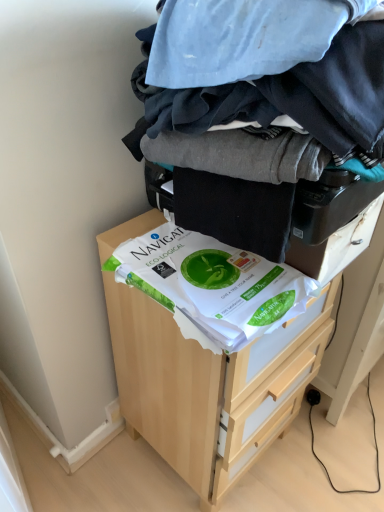
Question: From a real-world perspective, is white paper at center positioned over light wood chest of drawers at center based on gravity?

Choices:
 (A) no
 (B) yes

Answer: (B)

Question: Considering the relative sizes of white paper at center and light wood chest of drawers at center in the image provided, is white paper at center smaller than light wood chest of drawers at center?

Choices:
 (A) no
 (B) yes

Answer: (B)

Question: Is white paper at center directly adjacent to light wood chest of drawers at center?

Choices:
 (A) yes
 (B) no

Answer: (B)

Question: Does white paper at center have a greater height compared to light wood chest of drawers at center?

Choices:
 (A) no
 (B) yes

Answer: (A)

Question: Is white paper at center aimed at light wood chest of drawers at center?

Choices:
 (A) no
 (B) yes

Answer: (A)

Question: Can you confirm if white paper at center is bigger than light wood chest of drawers at center?

Choices:
 (A) no
 (B) yes

Answer: (A)

Question: Is dark blue cotton laundry at center oriented away from light wood chest of drawers at center?

Choices:
 (A) no
 (B) yes

Answer: (A)

Question: Could you tell me if dark blue cotton laundry at center is facing light wood chest of drawers at center?

Choices:
 (A) yes
 (B) no

Answer: (B)

Question: Is dark blue cotton laundry at center in contact with light wood chest of drawers at center?

Choices:
 (A) yes
 (B) no

Answer: (B)

Question: Can you confirm if dark blue cotton laundry at center is shorter than light wood chest of drawers at center?

Choices:
 (A) yes
 (B) no

Answer: (A)

Question: Can you confirm if dark blue cotton laundry at center is bigger than light wood chest of drawers at center?

Choices:
 (A) no
 (B) yes

Answer: (A)

Question: Is dark blue cotton laundry at center positioned behind light wood chest of drawers at center?

Choices:
 (A) yes
 (B) no

Answer: (B)

Question: Could you tell me if dark blue cotton laundry at center is turned towards white paper at center?

Choices:
 (A) yes
 (B) no

Answer: (B)